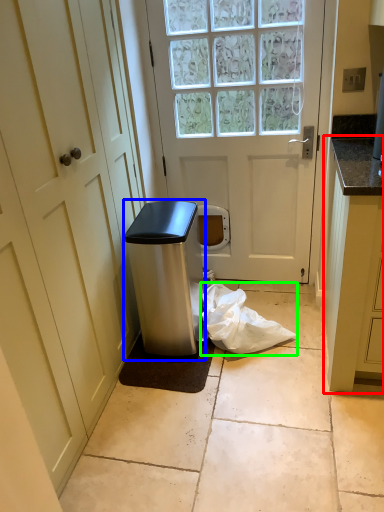
Question: Based on their relative distances, which object is nearer to cabinetry (highlighted by a red box)? Choose from appliance (highlighted by a blue box) and plastic bag (highlighted by a green box).

Choices:
 (A) appliance
 (B) plastic bag

Answer: (B)